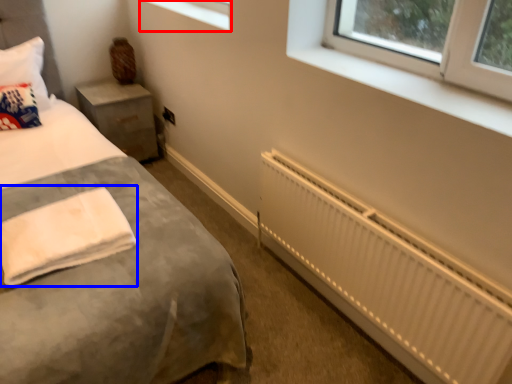
Question: Among these objects, which one is farthest to the camera, window (highlighted by a red box) or cloth (highlighted by a blue box)?

Choices:
 (A) window
 (B) cloth

Answer: (A)